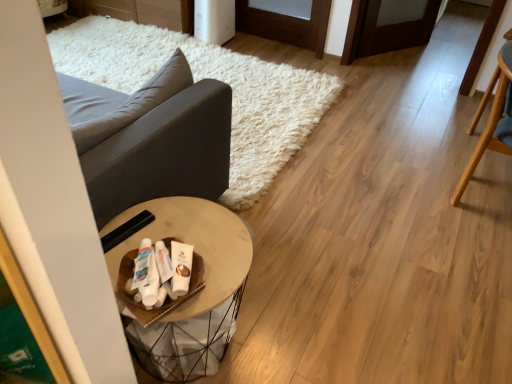
Question: Does dark gray fabric couch at left have a lesser height compared to wooden round table at center?

Choices:
 (A) no
 (B) yes

Answer: (B)

Question: Is dark gray fabric couch at left next to wooden round table at center and touching it?

Choices:
 (A) no
 (B) yes

Answer: (A)

Question: Would you say dark gray fabric couch at left is a long distance from wooden round table at center?

Choices:
 (A) yes
 (B) no

Answer: (B)

Question: Does dark gray fabric couch at left have a greater height compared to wooden round table at center?

Choices:
 (A) no
 (B) yes

Answer: (A)

Question: Is dark gray fabric couch at left positioned with its back to wooden round table at center?

Choices:
 (A) yes
 (B) no

Answer: (B)

Question: In terms of size, does light brown wooden chair at right, which ranks as the 1th chair in back-to-front order, appear bigger or smaller than white matte toothpaste tube at center, which is counted as the 1th toiletry, starting from the left?

Choices:
 (A) small
 (B) big

Answer: (B)

Question: In terms of width, does light brown wooden chair at right, which ranks as the 1th chair in back-to-front order, look wider or thinner when compared to white matte toothpaste tube at center, which is counted as the 1th toiletry, starting from the left?

Choices:
 (A) wide
 (B) thin

Answer: (A)

Question: Considering the positions of point [499, 71] and point [148, 243], is point [499, 71] closer or farther from the camera than point [148, 243]?

Choices:
 (A) farther
 (B) closer

Answer: (A)

Question: From a real-world perspective, is light brown wooden chair at right, which ranks as the second chair in front-to-back order, positioned above or below white matte toothpaste tube at center, which is counted as the 1th toiletry, starting from the left?

Choices:
 (A) below
 (B) above

Answer: (A)

Question: Visually, is dark gray fabric couch at left positioned to the left or to the right of white matte lotion at center, arranged as the first toiletry when viewed from the right?

Choices:
 (A) right
 (B) left

Answer: (B)

Question: Looking at their shapes, would you say dark gray fabric couch at left is wider or thinner than white matte lotion at center, which is the third toiletry in left-to-right order?

Choices:
 (A) wide
 (B) thin

Answer: (A)

Question: From a real-world perspective, is dark gray fabric couch at left positioned above or below white matte lotion at center, which is the third toiletry in left-to-right order?

Choices:
 (A) below
 (B) above

Answer: (B)

Question: From the image's perspective, is dark gray fabric couch at left located above or below white matte lotion at center, arranged as the first toiletry when viewed from the right?

Choices:
 (A) above
 (B) below

Answer: (A)

Question: Based on their positions, is white glossy tube at center, the 2th toiletry from the left, located to the left or right of white matte toothpaste tube at center, which is counted as the 1th toiletry, starting from the left?

Choices:
 (A) left
 (B) right

Answer: (B)

Question: Is point (148, 299) closer or farther from the camera than point (143, 276)?

Choices:
 (A) farther
 (B) closer

Answer: (B)